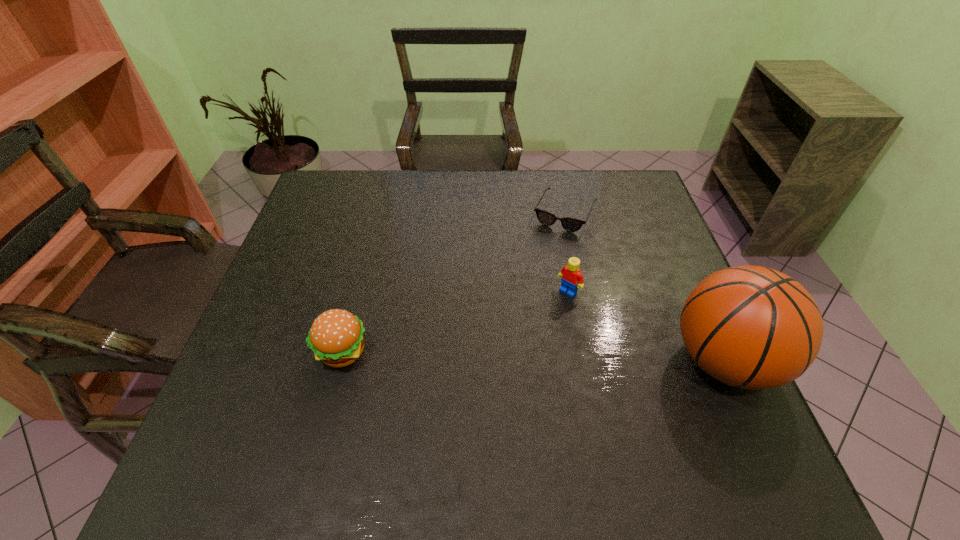
Image resolution: width=960 pixels, height=540 pixels. What are the coordinates of `hamburger` in the screenshot? It's located at (336, 337).

In order to click on basketball in this screenshot , I will do `click(751, 327)`.

Where is `the tallest object`? The height and width of the screenshot is (540, 960). the tallest object is located at coordinates (751, 327).

At what (x,y) coordinates should I click in order to perform the action: click on the shortest object. Please return your answer as a coordinate pair (x, y). The height and width of the screenshot is (540, 960). Looking at the image, I should click on (570, 224).

Where is `sunglasses`? This screenshot has width=960, height=540. sunglasses is located at coordinates (570, 224).

Locate an element on the screen. This screenshot has height=540, width=960. the third nearest object is located at coordinates (571, 278).

Where is `blank space located on the back of the hamburger`? This screenshot has width=960, height=540. blank space located on the back of the hamburger is located at coordinates (361, 280).

This screenshot has width=960, height=540. Identify the location of free space located 0.290m on the left of the tallest object. (536, 361).

Where is `free spot located 0.290m on the front lenses of the sunglasses`? This screenshot has height=540, width=960. free spot located 0.290m on the front lenses of the sunglasses is located at coordinates (520, 303).

The width and height of the screenshot is (960, 540). I want to click on vacant space located 0.140m on the front lenses of the sunglasses, so click(x=540, y=264).